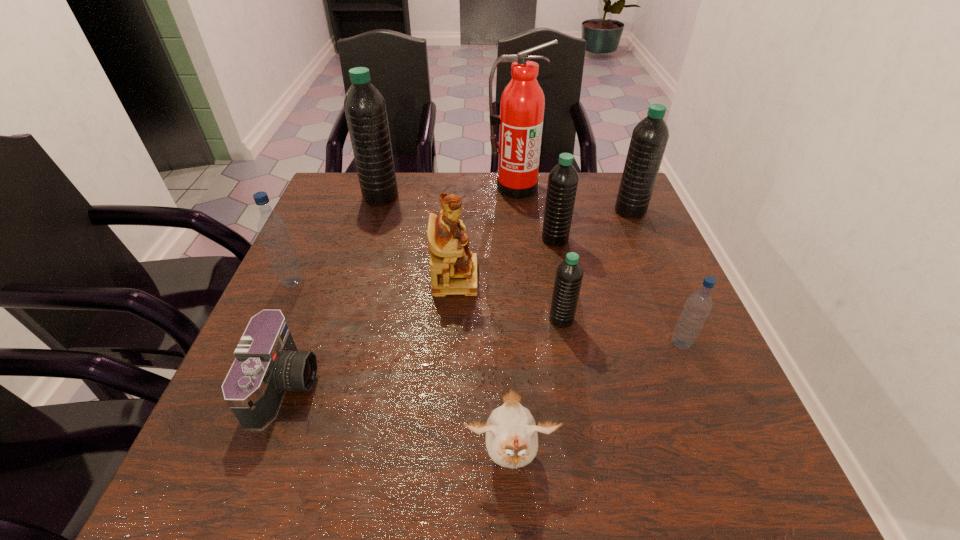
Find the location of a particular element. This screenshot has width=960, height=540. free spot located 0.250m on the left of the second tallest water bottle is located at coordinates (527, 211).

This screenshot has width=960, height=540. I want to click on vacant region located on the right of the third biggest black water bottle, so click(599, 239).

Locate an element on the screen. Image resolution: width=960 pixels, height=540 pixels. vacant area located 0.270m on the back of the bigger blue water bottle is located at coordinates (325, 209).

This screenshot has width=960, height=540. Find the location of `vacant space positioned 0.350m on the front-facing side of the figurine`. vacant space positioned 0.350m on the front-facing side of the figurine is located at coordinates (624, 278).

I want to click on vacant space positioned on the left of the right blue water bottle, so click(x=626, y=343).

Where is `vacant point located on the back of the second nearest water bottle`? vacant point located on the back of the second nearest water bottle is located at coordinates (550, 255).

At what (x,y) coordinates should I click in order to perform the action: click on vacant point located 0.070m on the front-facing side of the shortest object. Please return your answer as a coordinate pair (x, y). Looking at the image, I should click on (353, 385).

You are a GUI agent. You are given a task and a screenshot of the screen. Output one action in this format:
    pyautogui.click(x=<x>, y=<y>)
    Task: Click on the fire extinguisher located at the far edge
    Image resolution: width=960 pixels, height=540 pixels.
    Given the screenshot: What is the action you would take?
    pyautogui.click(x=522, y=105)

This screenshot has width=960, height=540. Identify the location of object at the near edge. (511, 433).

This screenshot has width=960, height=540. Identify the location of camera that is at the left edge. (267, 363).